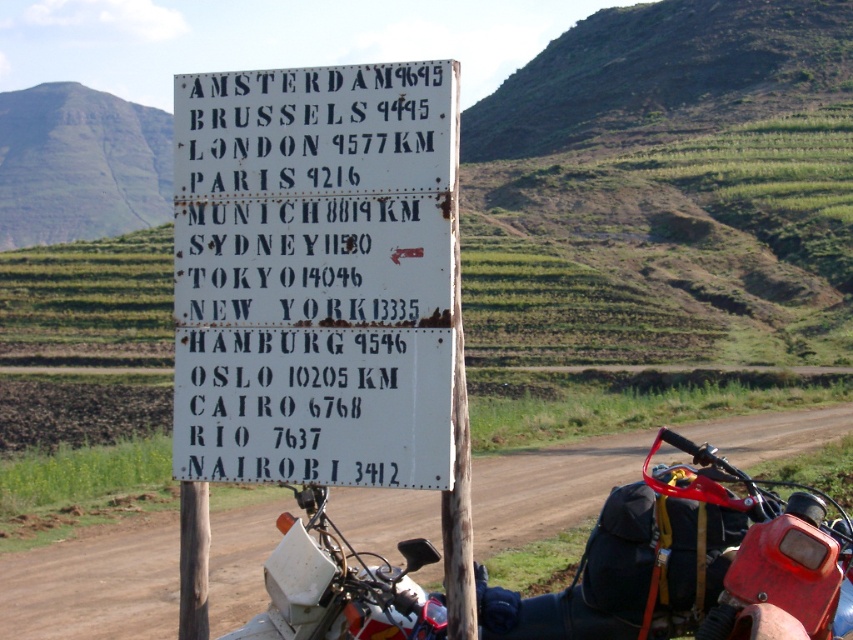
Question: Does white paper sign at center have a smaller size compared to red plastic motorcycle at lower right?

Choices:
 (A) yes
 (B) no

Answer: (B)

Question: Which of the following is the farthest from the observer?

Choices:
 (A) white paper sign at center
 (B) red plastic motorcycle at lower right

Answer: (B)

Question: Can you confirm if white paper sign at center is smaller than red plastic motorcycle at lower right?

Choices:
 (A) no
 (B) yes

Answer: (A)

Question: Does white paper sign at center have a larger size compared to red plastic motorcycle at lower right?

Choices:
 (A) no
 (B) yes

Answer: (B)

Question: Which point is farther from the camera taking this photo?

Choices:
 (A) (393, 115)
 (B) (618, 624)

Answer: (B)